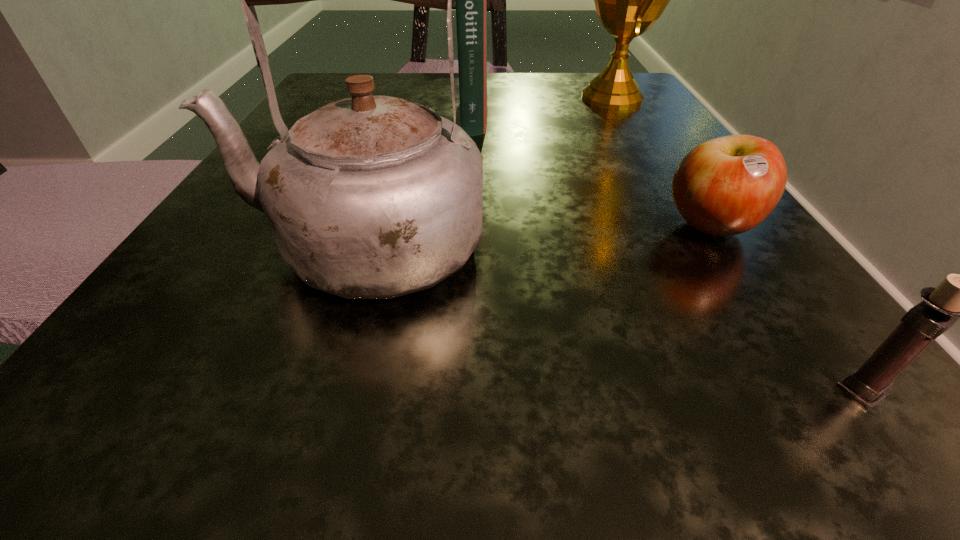
Find the location of a particular element. The width and height of the screenshot is (960, 540). object that is positioned at the near right corner is located at coordinates (957, 297).

Identify the location of vacant position at the far edge of the desktop. (429, 90).

You are a GUI agent. You are given a task and a screenshot of the screen. Output one action in this format:
    pyautogui.click(x=<x>, y=<y>)
    Task: Click on the free space at the near edge of the desktop
    This screenshot has width=960, height=540.
    Given the screenshot: What is the action you would take?
    pyautogui.click(x=394, y=441)

Identify the location of free space at the left edge. (256, 327).

Image resolution: width=960 pixels, height=540 pixels. In the image, there is a desktop. Identify the location of vacant space at the right edge. (649, 190).

In the image, there is a desktop. At what (x,y) coordinates should I click in order to perform the action: click on blank space at the far left corner. Please return your answer as a coordinate pair (x, y). The width and height of the screenshot is (960, 540). Looking at the image, I should click on (343, 81).

Locate an element on the screen. vacant region at the near left corner is located at coordinates (134, 372).

The width and height of the screenshot is (960, 540). I want to click on vacant area at the far right corner, so click(590, 115).

Locate an element on the screen. This screenshot has width=960, height=540. free space between the kettle and the candle holder is located at coordinates point(612,318).

Where is `vacant area that lies between the hardback book and the apple`? vacant area that lies between the hardback book and the apple is located at coordinates (591, 170).